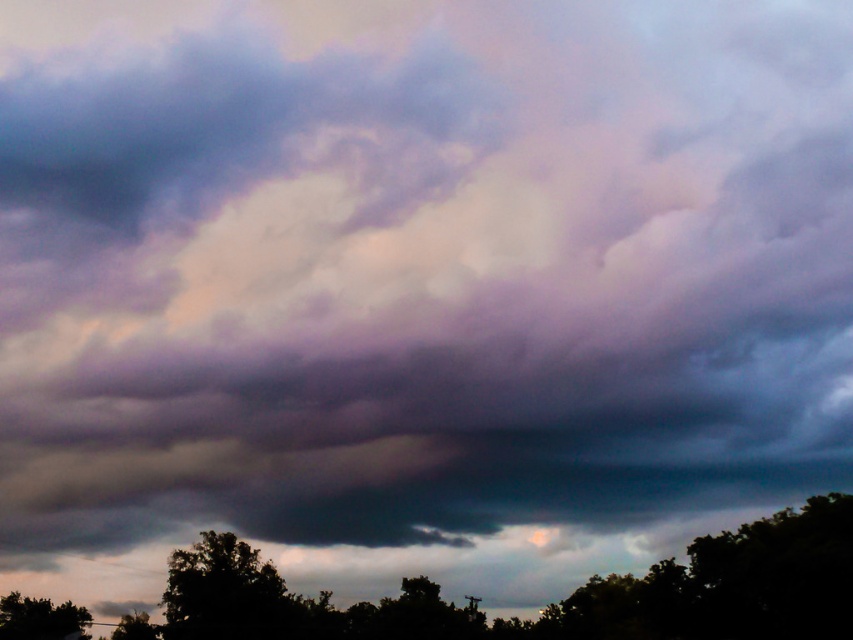
Question: Can you confirm if green leafy tree at lower center is thinner than green matte tree at lower left?

Choices:
 (A) no
 (B) yes

Answer: (A)

Question: Which of the following is the farthest from the observer?

Choices:
 (A) green matte tree at lower left
 (B) silhouette leafy tree at lower center

Answer: (A)

Question: Which point is closer to the camera?

Choices:
 (A) green leafy tree at lower center
 (B) silhouette leafy tree at lower center
 (C) green matte tree at lower left

Answer: (A)

Question: Among these points, which one is nearest to the camera?

Choices:
 (A) (161, 632)
 (B) (318, 632)

Answer: (B)

Question: Does green leafy tree at lower center have a larger size compared to silhouette leafy tree at lower center?

Choices:
 (A) yes
 (B) no

Answer: (A)

Question: Can you confirm if green leafy tree at lower center is smaller than silhouette leafy tree at lower center?

Choices:
 (A) yes
 (B) no

Answer: (B)